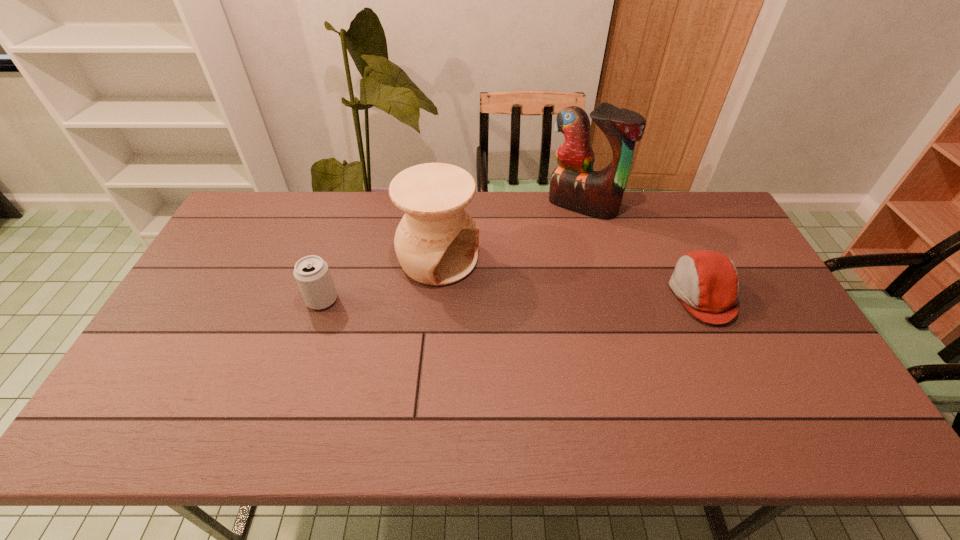
At what (x,y) coordinates should I click in order to perform the action: click on free space between the second object from right to left and the pottery. Please return your answer as a coordinate pair (x, y). Image resolution: width=960 pixels, height=540 pixels. Looking at the image, I should click on (511, 233).

Locate an element on the screen. The height and width of the screenshot is (540, 960). unoccupied area between the second object from right to left and the shortest object is located at coordinates (642, 250).

This screenshot has width=960, height=540. I want to click on vacant region between the cap and the third object from right to left, so click(x=570, y=277).

Where is `vacant space that is in between the third shortest object and the parrot`? Image resolution: width=960 pixels, height=540 pixels. vacant space that is in between the third shortest object and the parrot is located at coordinates click(511, 233).

Identify the location of free spot between the cap and the parrot. Image resolution: width=960 pixels, height=540 pixels. (642, 250).

The width and height of the screenshot is (960, 540). Identify the location of free space between the rightmost object and the leftmost object. [x=513, y=297].

You are a GUI agent. You are given a task and a screenshot of the screen. Output one action in this format:
    pyautogui.click(x=<x>, y=<y>)
    Task: Click on the object that stands as the third closest to the parrot
    This screenshot has height=540, width=960.
    Given the screenshot: What is the action you would take?
    pyautogui.click(x=312, y=274)

Locate which object ranks second in proximity to the shortest object. Please provide its 2D coordinates. Your answer should be formatted as a tuple, i.e. [(x, y)], where the tuple contains the x and y coordinates of a point satisfying the conditions above.

[(436, 242)]

Locate an element on the screen. This screenshot has height=540, width=960. free space that satisfies the following two spatial constraints: 1. on the back side of the can; 2. on the front-facing side of the shortest object is located at coordinates (324, 294).

Where is `free space that satisfies the following two spatial constraints: 1. on the back side of the second shortest object; 2. on the left side of the second tallest object`? The height and width of the screenshot is (540, 960). free space that satisfies the following two spatial constraints: 1. on the back side of the second shortest object; 2. on the left side of the second tallest object is located at coordinates (336, 260).